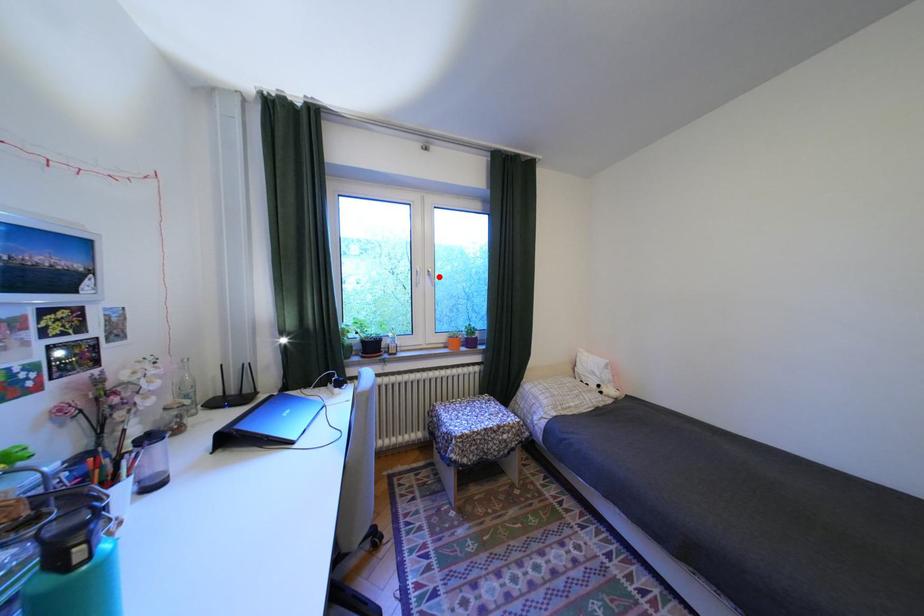
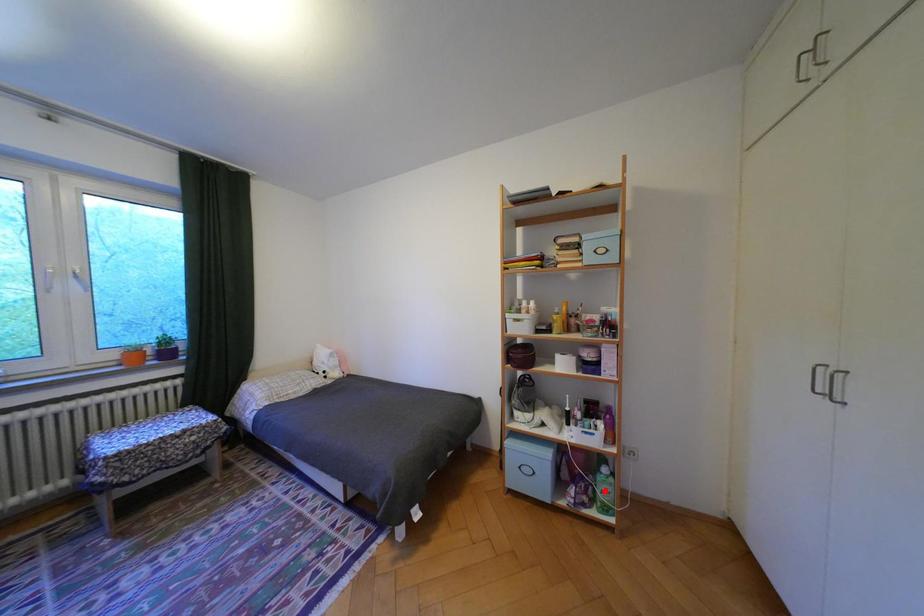
I am providing you with two images of the same scene from different viewpoints. A red point is marked on the first image and another point is marked on the second image. Are the points marked in image1 and image2 representing the same 3D position?

No